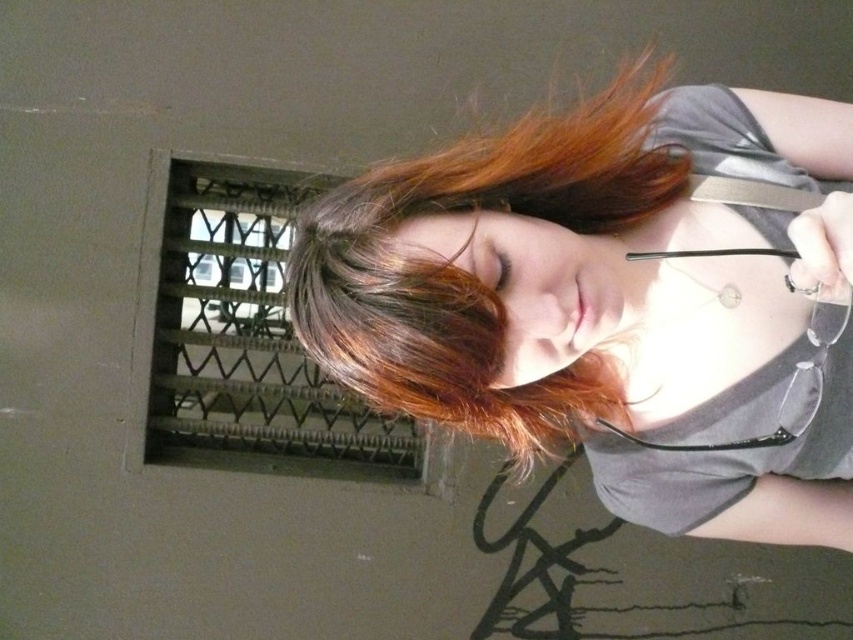
What do you see at coordinates (741, 339) in the screenshot? The image size is (853, 640). I see `matte gray shirt at center` at bounding box center [741, 339].

You are a GUI agent. You are given a task and a screenshot of the screen. Output one action in this format:
    pyautogui.click(x=<x>, y=<y>)
    Task: Click on the matte gray shirt at center
    
    Given the screenshot: What is the action you would take?
    pyautogui.click(x=741, y=339)